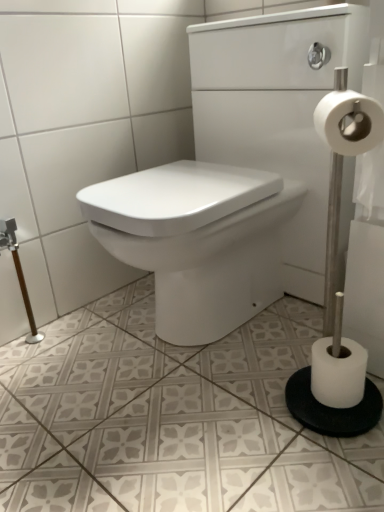
Question: Considering their positions, is white glossy sink at center located in front of or behind white matte toilet paper at right?

Choices:
 (A) front
 (B) behind

Answer: (A)

Question: From a real-world perspective, is white glossy sink at center physically located above or below white matte toilet paper at right?

Choices:
 (A) above
 (B) below

Answer: (A)

Question: Considering the positions of white glossy sink at center and white matte toilet paper at right in the image, is white glossy sink at center bigger or smaller than white matte toilet paper at right?

Choices:
 (A) big
 (B) small

Answer: (A)

Question: Considering their positions, is white matte toilet paper at right located in front of or behind white glossy sink at center?

Choices:
 (A) front
 (B) behind

Answer: (B)

Question: From a real-world perspective, is white matte toilet paper at right physically located above or below white glossy sink at center?

Choices:
 (A) below
 (B) above

Answer: (A)

Question: From the image's perspective, is white matte toilet paper at right positioned above or below white glossy sink at center?

Choices:
 (A) above
 (B) below

Answer: (B)

Question: Looking at their shapes, would you say white matte toilet paper at right is wider or thinner than white glossy sink at center?

Choices:
 (A) thin
 (B) wide

Answer: (A)